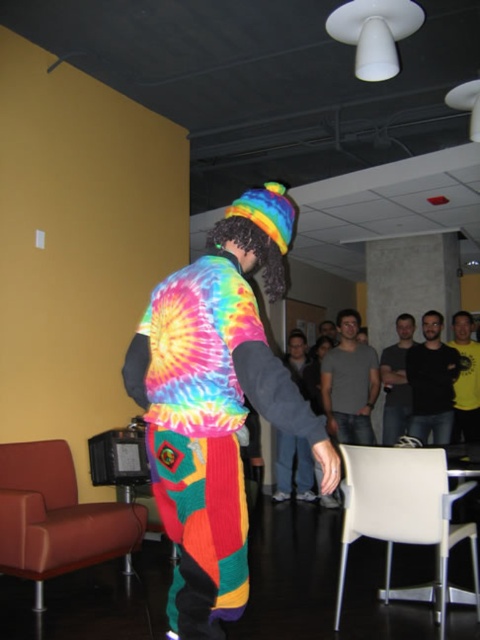
Does dark gray cotton shirt at center have a smaller size compared to yellow t-shirt at center?

No.

Between point (405, 326) and point (471, 368), which one is positioned behind?

Point (405, 326)

You are a GUI agent. You are given a task and a screenshot of the screen. Output one action in this format:
    pyautogui.click(x=<x>, y=<y>)
    Task: Click on the dark gray cotton shirt at center
    This screenshot has height=640, width=480.
    Given the screenshot: What is the action you would take?
    pyautogui.click(x=396, y=381)

Measure the distance from black cotton shirt at center to rainbow tie-dye sweater at center.

A distance of 5.76 feet exists between black cotton shirt at center and rainbow tie-dye sweater at center.

Does black cotton shirt at center have a lesser height compared to rainbow tie-dye sweater at center?

In fact, black cotton shirt at center may be taller than rainbow tie-dye sweater at center.

Locate an element on the screen. This screenshot has height=640, width=480. black cotton shirt at center is located at coordinates (432, 381).

You are a GUI agent. You are given a task and a screenshot of the screen. Output one action in this format:
    pyautogui.click(x=<x>, y=<y>)
    Task: Click on the black cotton shirt at center
    This screenshot has height=640, width=480.
    Given the screenshot: What is the action you would take?
    pyautogui.click(x=432, y=381)

Who is shorter, white plastic chair at lower right or gray cotton t-shirt at center?

Standing shorter between the two is white plastic chair at lower right.

Is white plastic chair at lower right above gray cotton t-shirt at center?

Actually, white plastic chair at lower right is below gray cotton t-shirt at center.

Measure the distance between white plastic chair at lower right and camera.

8.10 feet

Where is `white plastic chair at lower right`? Image resolution: width=480 pixels, height=640 pixels. white plastic chair at lower right is located at coordinates (404, 512).